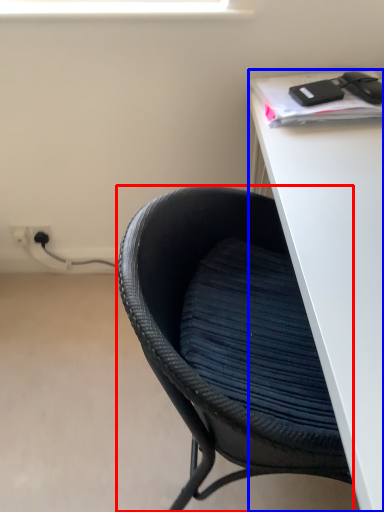
Question: Which object is further to the camera taking this photo, chair (highlighted by a red box) or desk (highlighted by a blue box)?

Choices:
 (A) chair
 (B) desk

Answer: (A)